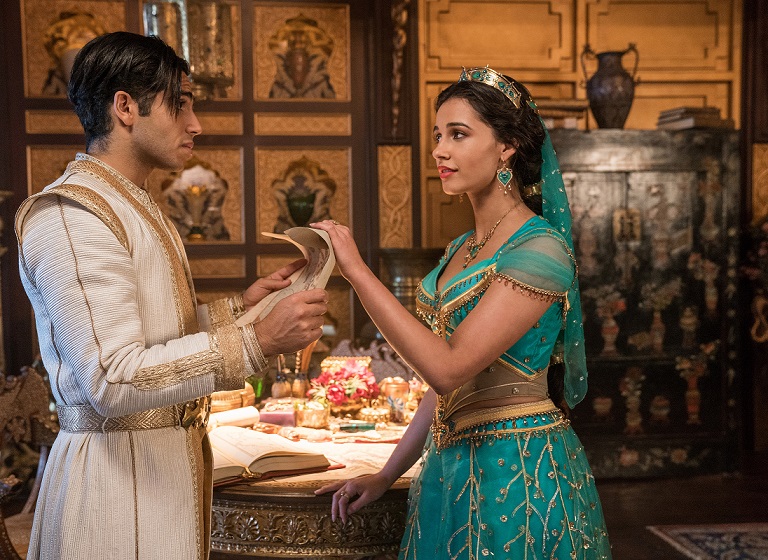
What are the coordinates of `urns in the wall` in the screenshot? It's located at (298, 76), (300, 185), (197, 203), (64, 42).